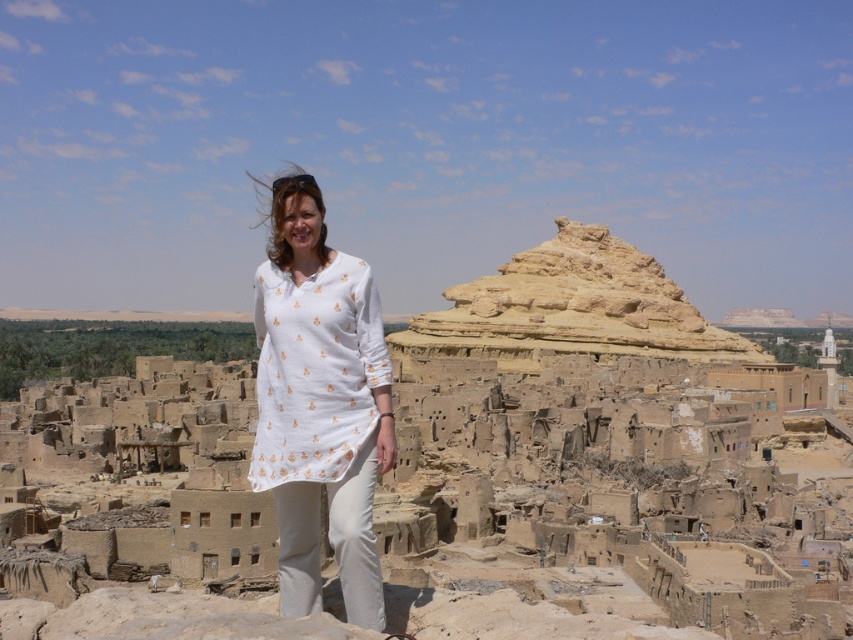
Question: Can you confirm if white cotton dress at center is smaller than earthy brown stone pyramid at center?

Choices:
 (A) yes
 (B) no

Answer: (A)

Question: Can you confirm if white cotton dress at center is positioned to the right of earthy brown stone pyramid at center?

Choices:
 (A) yes
 (B) no

Answer: (B)

Question: Does white cotton dress at center have a smaller size compared to earthy brown stone pyramid at center?

Choices:
 (A) yes
 (B) no

Answer: (A)

Question: Among these points, which one is nearest to the camera?

Choices:
 (A) (328, 429)
 (B) (556, 259)

Answer: (A)